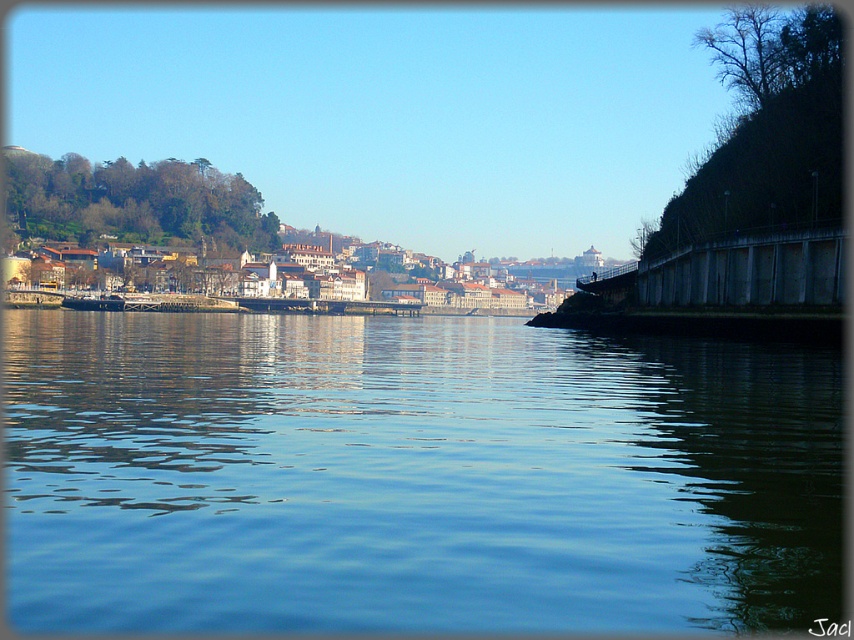
Question: Among these objects, which one is farthest from the camera?

Choices:
 (A) shiny black boat at center
 (B) blue liquid water at center

Answer: (A)

Question: Which point is farther to the camera?

Choices:
 (A) blue liquid water at center
 (B) shiny black boat at center

Answer: (B)

Question: Is blue liquid water at center to the right of shiny black boat at center from the viewer's perspective?

Choices:
 (A) yes
 (B) no

Answer: (A)

Question: Is blue liquid water at center bigger than shiny black boat at center?

Choices:
 (A) yes
 (B) no

Answer: (A)

Question: Does blue liquid water at center have a lesser width compared to shiny black boat at center?

Choices:
 (A) yes
 (B) no

Answer: (B)

Question: Which of the following is the closest to the observer?

Choices:
 (A) (62, 301)
 (B) (616, 417)

Answer: (B)